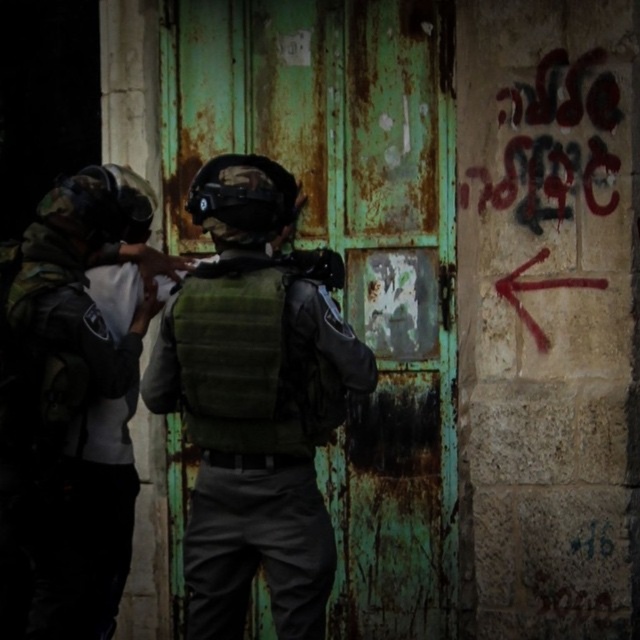
In the scene shown: You are a security officer assessing the scene. The rusty metal door at center and the camouflage fabric helmet at left are in view. Which object is taller?

The rusty metal door at center is taller than the camouflage fabric helmet at left.

You are a security officer tasked with measuring the dimensions of objects in the scene. The rusty metal door at center and the camouflage fabric helmet at left are both in your line of sight. Which object has a greater width?

The rusty metal door at center has a greater width than the camouflage fabric helmet at left, as stated in the description.

You are a security guard assessing the scene. You need to determine the relative positions of the rusty metal door at center and the camouflage fabric helmet at left. Which object is positioned to the right of the other?

The rusty metal door at center is to the right of camouflage fabric helmet at left.